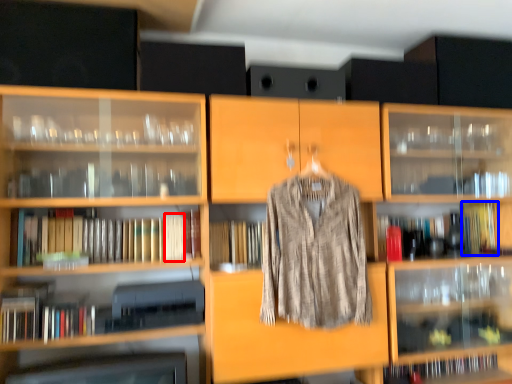
Question: Which object is closer to the camera taking this photo, book (highlighted by a red box) or book (highlighted by a blue box)?

Choices:
 (A) book
 (B) book

Answer: (A)